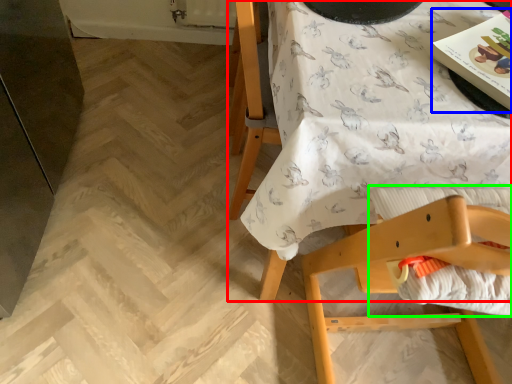
Question: Considering the real-world distances, which object is farthest from table (highlighted by a red box)? magazine (highlighted by a blue box) or sheet (highlighted by a green box)?

Choices:
 (A) magazine
 (B) sheet

Answer: (A)